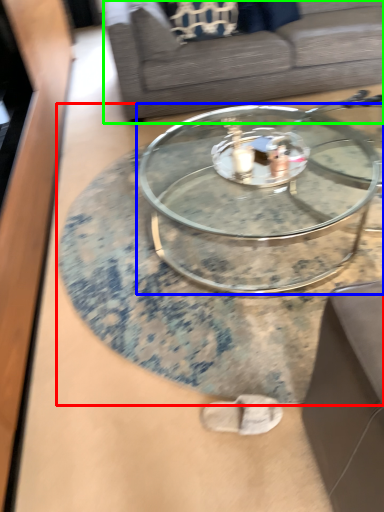
Question: Which is farther away from coffee table (highlighted by a red box)? coffee table (highlighted by a blue box) or studio couch (highlighted by a green box)?

Choices:
 (A) coffee table
 (B) studio couch

Answer: (B)